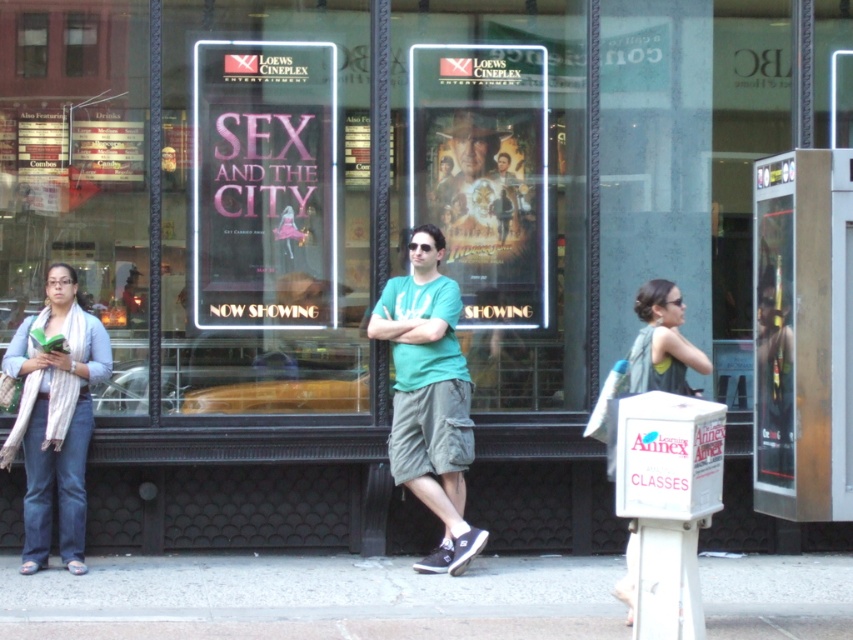
Does green cotton t-shirt at center appear on the left side of green fabric tank top at center?

Yes, green cotton t-shirt at center is to the left of green fabric tank top at center.

Does green cotton t-shirt at center appear over green fabric tank top at center?

Actually, green cotton t-shirt at center is below green fabric tank top at center.

Consider the image. Who is more distant from viewer, [410,275] or [663,328]?

The point [410,275] is behind.

The width and height of the screenshot is (853, 640). I want to click on green cotton t-shirt at center, so click(x=428, y=396).

Between gray concrete pavement at lower center and green cotton t-shirt at center, which one appears on the right side from the viewer's perspective?

Positioned to the right is green cotton t-shirt at center.

Does gray concrete pavement at lower center appear on the right side of green cotton t-shirt at center?

In fact, gray concrete pavement at lower center is to the left of green cotton t-shirt at center.

Is point (837, 563) closer to camera compared to point (444, 403)?

No.

Locate an element on the screen. gray concrete pavement at lower center is located at coordinates (312, 598).

Describe the element at coordinates (312, 598) in the screenshot. I see `gray concrete pavement at lower center` at that location.

The height and width of the screenshot is (640, 853). I want to click on gray concrete pavement at lower center, so click(312, 598).

Locate an element on the screen. This screenshot has height=640, width=853. gray concrete pavement at lower center is located at coordinates (312, 598).